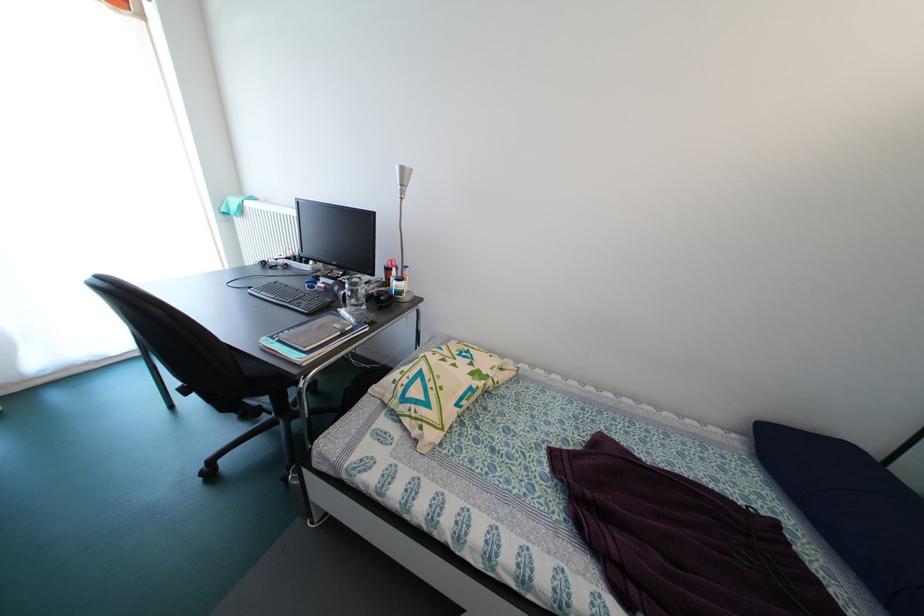
The width and height of the screenshot is (924, 616). What do you see at coordinates (355, 300) in the screenshot?
I see `the glass mug handle` at bounding box center [355, 300].